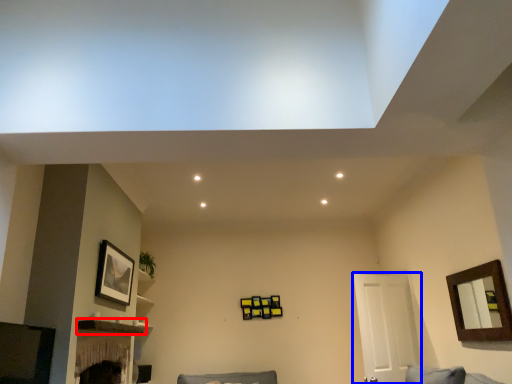
Question: Which object appears farthest to the camera in this image, shelf (highlighted by a red box) or door (highlighted by a blue box)?

Choices:
 (A) shelf
 (B) door

Answer: (B)